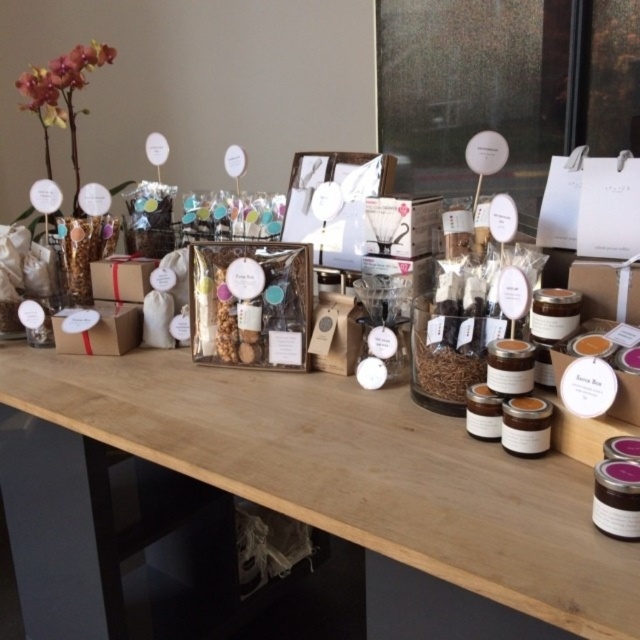
Question: Based on their relative distances, which object is farther from the wooden table at center?

Choices:
 (A) translucent glass jar at center
 (B) matte brown jar at center

Answer: (B)

Question: Does wooden table at center appear over translucent glass jar at center?

Choices:
 (A) no
 (B) yes

Answer: (A)

Question: Does wooden table at center have a smaller size compared to translucent glass jar at center?

Choices:
 (A) yes
 (B) no

Answer: (B)

Question: Is translucent glass jar at center positioned in front of matte brown jar at center?

Choices:
 (A) yes
 (B) no

Answer: (B)

Question: Which object is farther from the camera taking this photo?

Choices:
 (A) wooden table at center
 (B) matte brown jar at center

Answer: (B)

Question: Which of these objects is positioned closest to the matte brown jar at center?

Choices:
 (A) wooden table at center
 (B) translucent glass jar at center

Answer: (B)